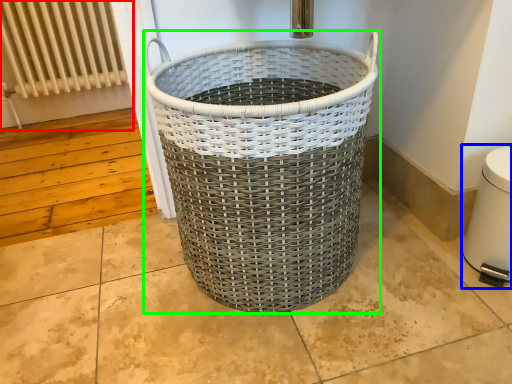
Question: Which object is positioned closest to radiator (highlighted by a red box)? Select from water heater (highlighted by a blue box) and waste container (highlighted by a green box).

Choices:
 (A) water heater
 (B) waste container

Answer: (B)